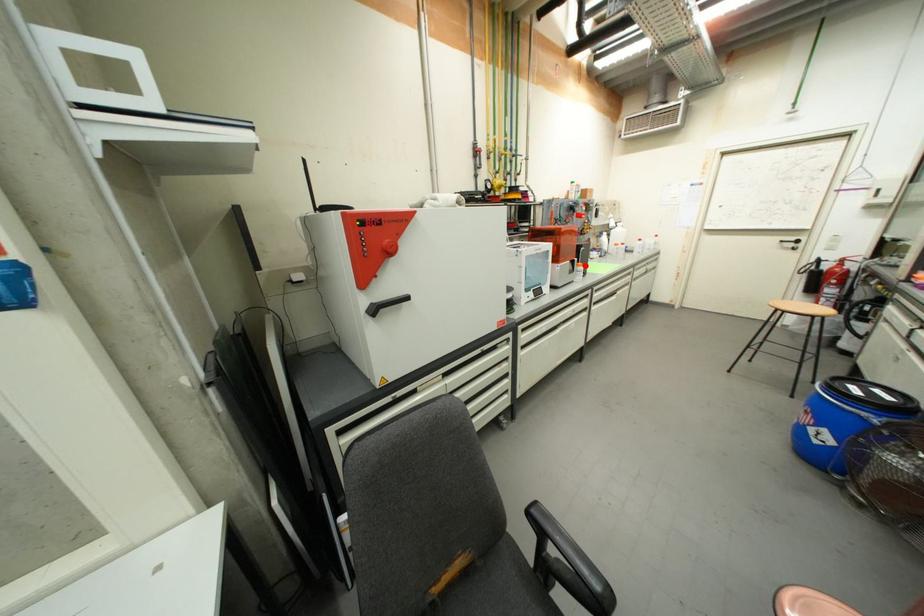
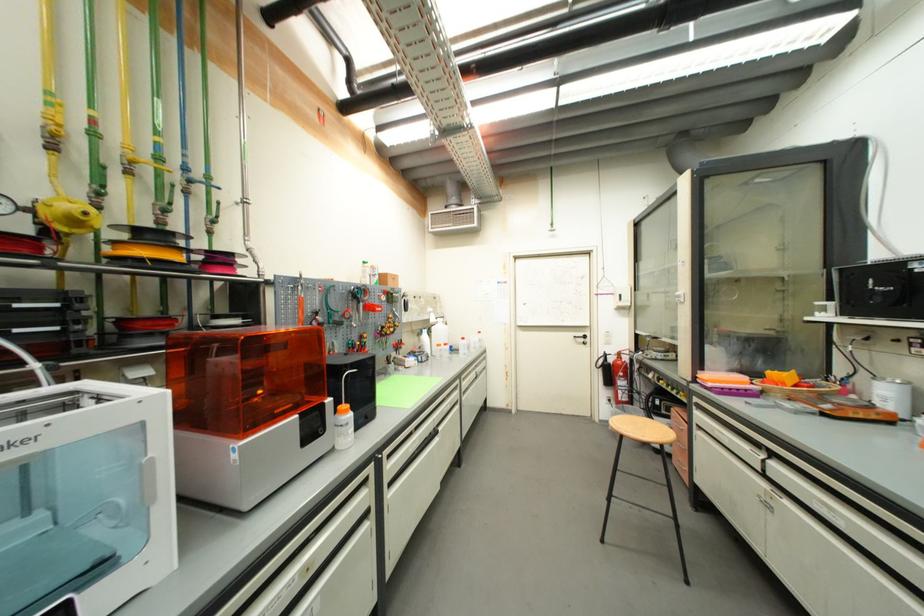
The point at the highlighted location is marked in the first image. Where is the corresponding point in the second image?

(349, 408)